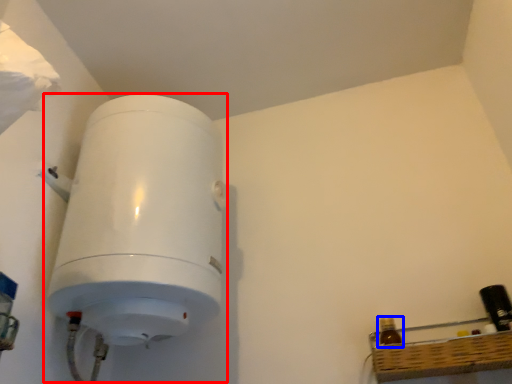
Question: Which object is closer to the camera taking this photo, appliance (highlighted by a red box) or bottle (highlighted by a blue box)?

Choices:
 (A) appliance
 (B) bottle

Answer: (A)